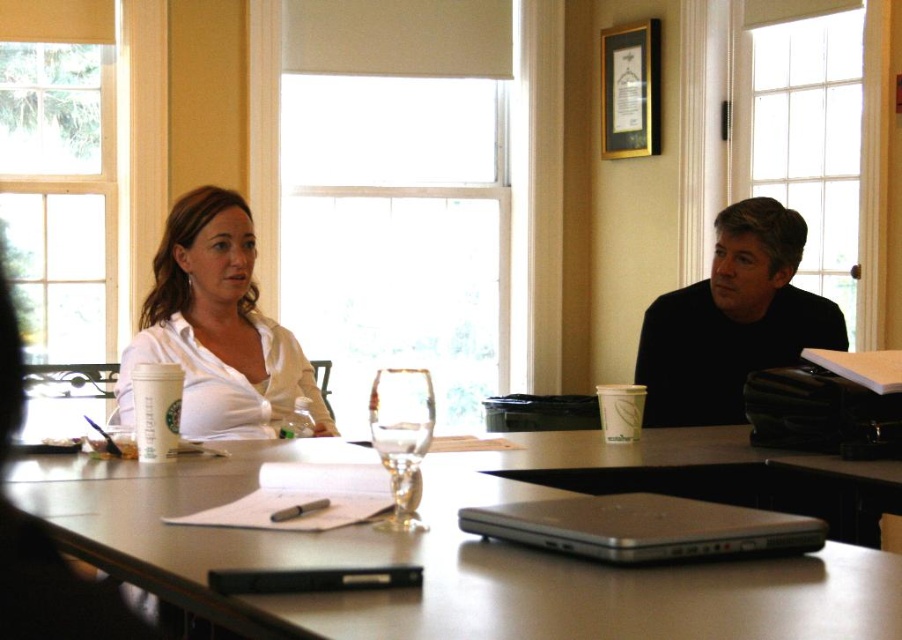
Who is lower down, black matte shirt at right or silver metallic laptop at center?

silver metallic laptop at center is below.

Is point (715, 403) positioned behind point (689, 525)?

Yes, it is.

Does point (686, 323) lie behind point (606, 515)?

Yes.

The image size is (902, 640). I want to click on black matte shirt at right, so click(732, 321).

Can you confirm if white satin blouse at upper left is positioned to the right of black matte shirt at right?

Incorrect, white satin blouse at upper left is not on the right side of black matte shirt at right.

Consider the image. Is white satin blouse at upper left below black matte shirt at right?

No, white satin blouse at upper left is not below black matte shirt at right.

Find the location of a particular element. The width and height of the screenshot is (902, 640). white satin blouse at upper left is located at coordinates 218,328.

Does matte silver laptop at center have a greater height compared to black matte shirt at right?

Incorrect, matte silver laptop at center's height is not larger of black matte shirt at right's.

At what (x,y) coordinates should I click in order to perform the action: click on matte silver laptop at center. Please return your answer as a coordinate pair (x, y). Looking at the image, I should click on (454, 552).

Between point (171, 490) and point (720, 364), which one is positioned in front?

Point (171, 490) is more forward.

Locate an element on the screen. The width and height of the screenshot is (902, 640). matte silver laptop at center is located at coordinates (454, 552).